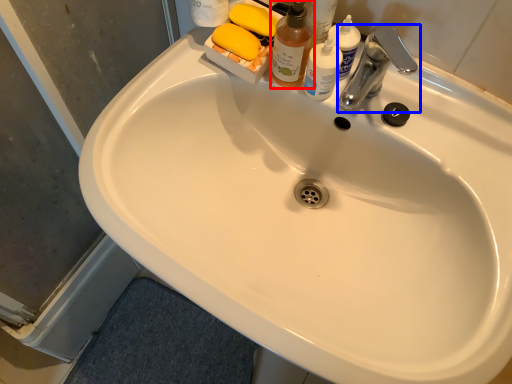
Question: Which object is further to the camera taking this photo, cleaning product (highlighted by a red box) or tap (highlighted by a blue box)?

Choices:
 (A) cleaning product
 (B) tap

Answer: (B)